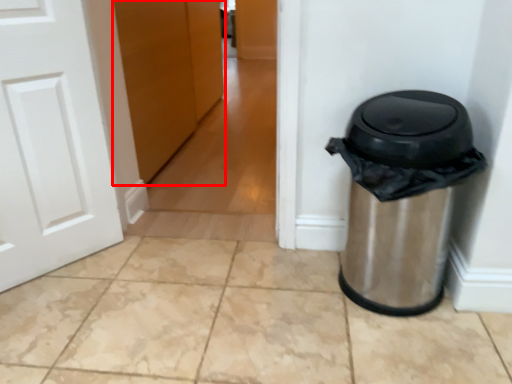
Question: From the image's perspective, what is the correct spatial positioning of door (annotated by the red box) in reference to waste container?

Choices:
 (A) above
 (B) below

Answer: (A)